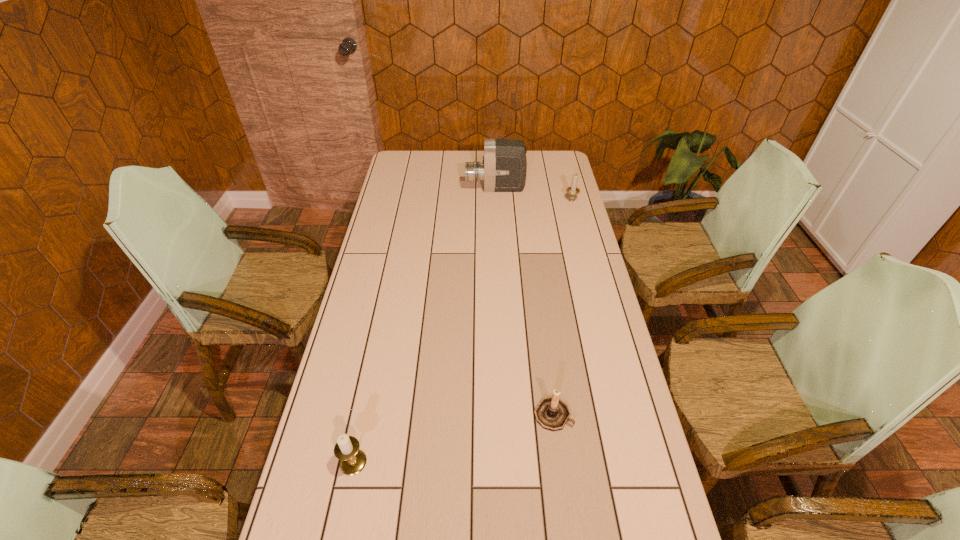
Where is `free space located 0.360m on the handle side of the farthest candle holder`? Image resolution: width=960 pixels, height=540 pixels. free space located 0.360m on the handle side of the farthest candle holder is located at coordinates (560, 156).

Find the location of a particular element. vacant space situated on the handle side of the farthest candle holder is located at coordinates (565, 177).

Locate an element on the screen. vacant space located 0.300m on the handle side of the farthest candle holder is located at coordinates (562, 161).

Image resolution: width=960 pixels, height=540 pixels. I want to click on vacant space situated 0.070m on the back of the nearest candle holder, so click(361, 424).

Image resolution: width=960 pixels, height=540 pixels. I want to click on vacant area situated on the left of the second nearest object, so click(501, 414).

Where is `object positioned at the left edge`? The width and height of the screenshot is (960, 540). object positioned at the left edge is located at coordinates (352, 460).

You are a GUI agent. You are given a task and a screenshot of the screen. Output one action in this format:
    pyautogui.click(x=<x>, y=<y>)
    Task: Click on the object present at the right edge
    The image size is (960, 540).
    Given the screenshot: What is the action you would take?
    pyautogui.click(x=572, y=191)

Where is `free region at the far edge of the desktop`? This screenshot has height=540, width=960. free region at the far edge of the desktop is located at coordinates (447, 169).

What are the coordinates of `vacant position at the left edge of the desktop` in the screenshot? It's located at (356, 347).

Find the location of a particular element. vacant area at the right edge of the desktop is located at coordinates (595, 293).